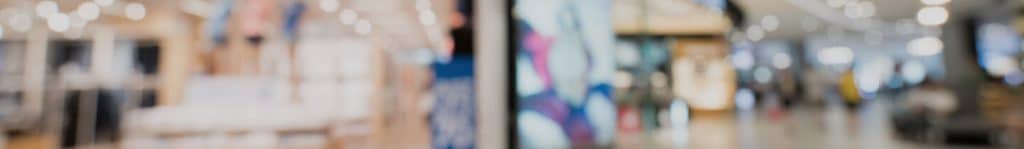
Locate an element on the screen. The image size is (1024, 149). blurry windows is located at coordinates (988, 44), (899, 46), (810, 45), (768, 51).